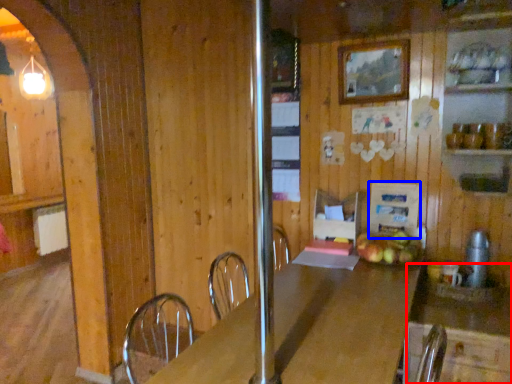
Question: Which of the following is the closest to the observer, counter (highlighted by a red box) or appliance (highlighted by a blue box)?

Choices:
 (A) counter
 (B) appliance

Answer: (A)